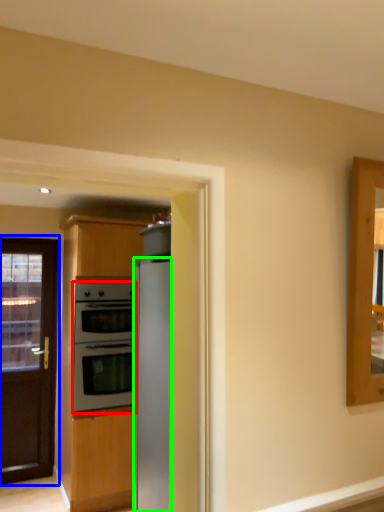
Question: Which object is positioned closest to oven (highlighted by a red box)? Select from door (highlighted by a blue box) and refrigerator (highlighted by a green box).

Choices:
 (A) door
 (B) refrigerator

Answer: (A)